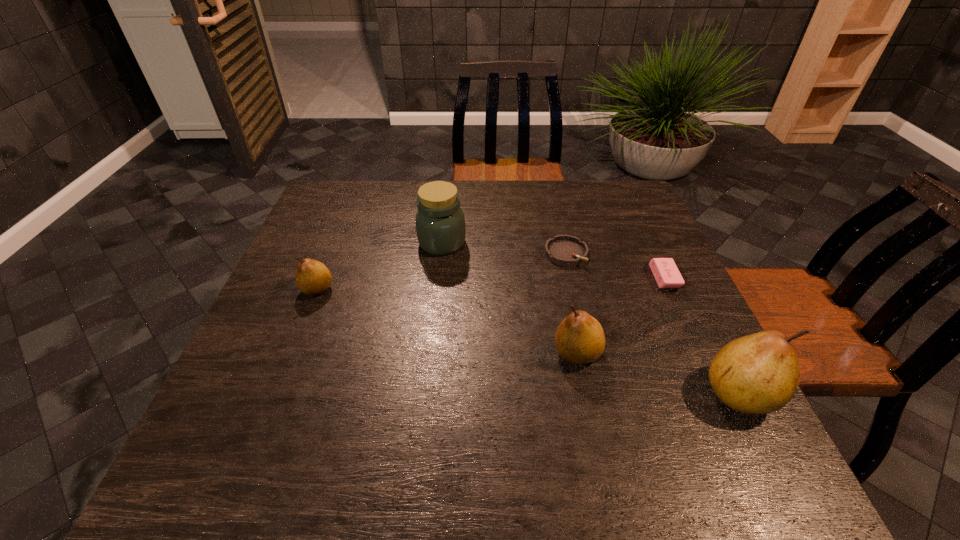
You are a GUI agent. You are given a task and a screenshot of the screen. Output one action in this format:
    pyautogui.click(x=<x>, y=<y>)
    Task: Click on the free space at the near edge
    
    Given the screenshot: What is the action you would take?
    pyautogui.click(x=640, y=428)

Find the location of a particular element. free space at the left edge of the desktop is located at coordinates (282, 272).

At what (x,y) coordinates should I click in order to perform the action: click on free space at the right edge. Please return your answer as a coordinate pair (x, y). This screenshot has height=540, width=960. Looking at the image, I should click on (655, 290).

Find the location of a particular element. The height and width of the screenshot is (540, 960). blank space at the far right corner is located at coordinates (644, 215).

Where is `vacant area that lies between the eraser and the second pear from left to right`? vacant area that lies between the eraser and the second pear from left to right is located at coordinates [620, 316].

The image size is (960, 540). Identify the location of unoccupied position between the third tallest object and the eraser. (620, 316).

Find the location of a particular element. This screenshot has height=540, width=960. vacant space that's between the tallest pear and the eraser is located at coordinates (702, 336).

I want to click on vacant space that is in between the rightmost pear and the leftmost object, so click(x=528, y=341).

At what (x,y) coordinates should I click in order to perform the action: click on vacant area that lies between the second object from left to right and the ashtray. Please return your answer as a coordinate pair (x, y). The width and height of the screenshot is (960, 540). Looking at the image, I should click on (x=504, y=248).

Where is `vacant region between the eraser and the second shortest pear`? This screenshot has height=540, width=960. vacant region between the eraser and the second shortest pear is located at coordinates (620, 316).